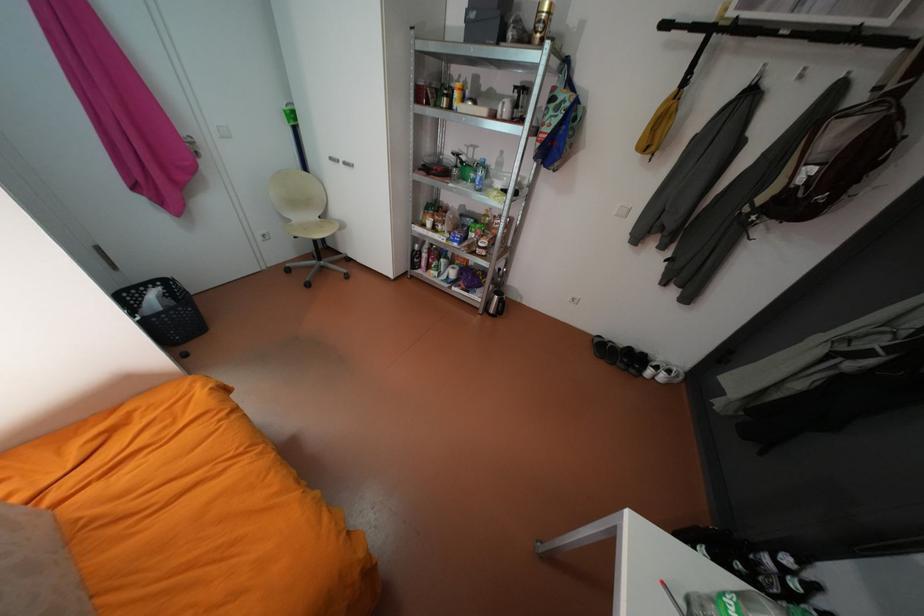
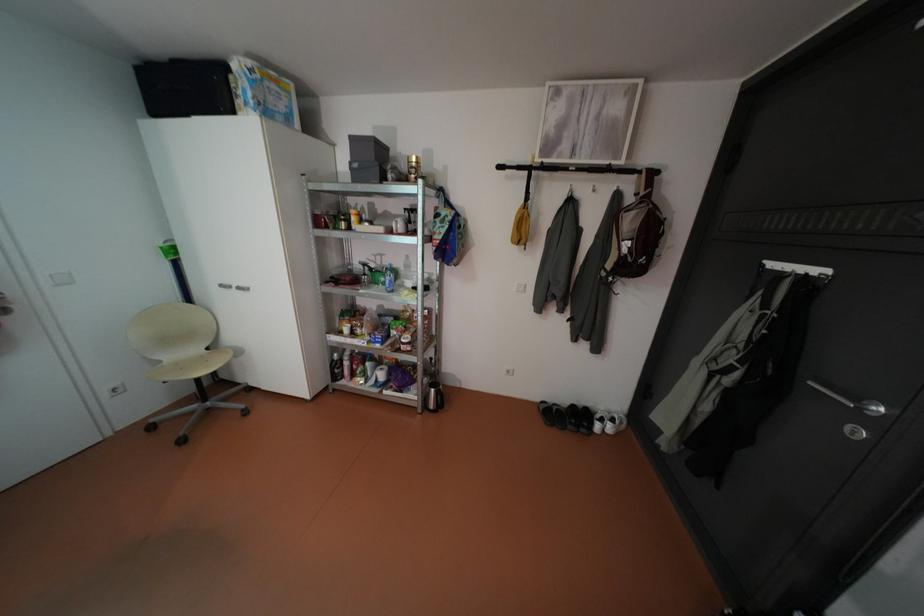
Where in the second image is the point corresponding to point 501,310 from the first image?

(441, 405)